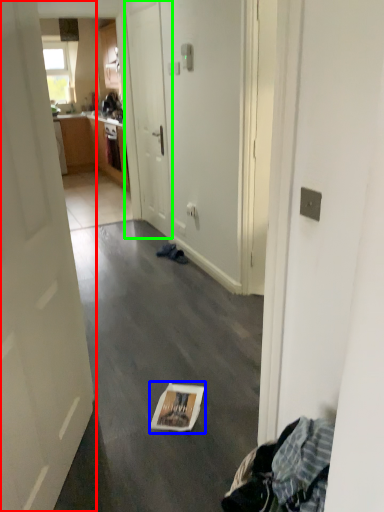
Question: Based on their relative distances, which object is farther from door (highlighted by a red box)? Choose from magazine (highlighted by a blue box) and door (highlighted by a green box).

Choices:
 (A) magazine
 (B) door

Answer: (B)